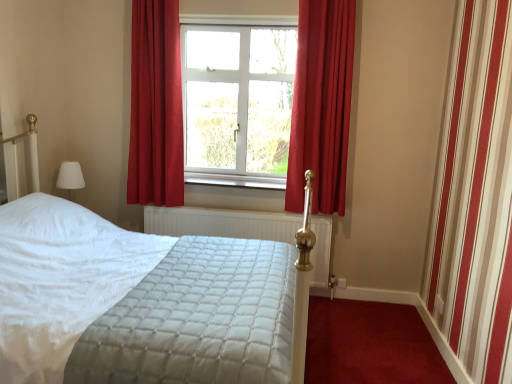
Question: From the image's perspective, is velvet red curtain at center, the first curtain viewed from the right, above white quilted mattress at center?

Choices:
 (A) no
 (B) yes

Answer: (B)

Question: Can you confirm if velvet red curtain at center, the first curtain viewed from the right, is bigger than white quilted mattress at center?

Choices:
 (A) no
 (B) yes

Answer: (A)

Question: Is velvet red curtain at center, the second curtain in the left-to-right sequence, at the left side of white quilted mattress at center?

Choices:
 (A) yes
 (B) no

Answer: (B)

Question: Considering the relative positions of velvet red curtain at center, the second curtain in the left-to-right sequence, and white quilted mattress at center in the image provided, is velvet red curtain at center, the second curtain in the left-to-right sequence, behind white quilted mattress at center?

Choices:
 (A) yes
 (B) no

Answer: (A)

Question: Can you confirm if velvet red curtain at center, the first curtain viewed from the right, is positioned to the right of white quilted mattress at center?

Choices:
 (A) no
 (B) yes

Answer: (B)

Question: Is velvet red curtain at center, the second curtain in the left-to-right sequence, oriented towards white quilted mattress at center?

Choices:
 (A) yes
 (B) no

Answer: (B)

Question: Does white painted wood at center have a smaller size compared to velvet red curtain at center, the first curtain viewed from the right?

Choices:
 (A) no
 (B) yes

Answer: (B)

Question: Does white painted wood at center appear on the right side of velvet red curtain at center, the second curtain in the left-to-right sequence?

Choices:
 (A) no
 (B) yes

Answer: (A)

Question: Is velvet red curtain at center, the first curtain viewed from the right, inside white painted wood at center?

Choices:
 (A) no
 (B) yes

Answer: (A)

Question: From a real-world perspective, is white painted wood at center beneath velvet red curtain at center, the second curtain in the left-to-right sequence?

Choices:
 (A) no
 (B) yes

Answer: (B)

Question: Does white painted wood at center appear on the left side of velvet red curtain at center, the second curtain in the left-to-right sequence?

Choices:
 (A) yes
 (B) no

Answer: (A)

Question: Does white painted wood at center have a lesser width compared to velvet red curtain at center, the second curtain in the left-to-right sequence?

Choices:
 (A) yes
 (B) no

Answer: (B)

Question: Is white quilted mattress at center placed right next to white textured radiator at center?

Choices:
 (A) yes
 (B) no

Answer: (B)